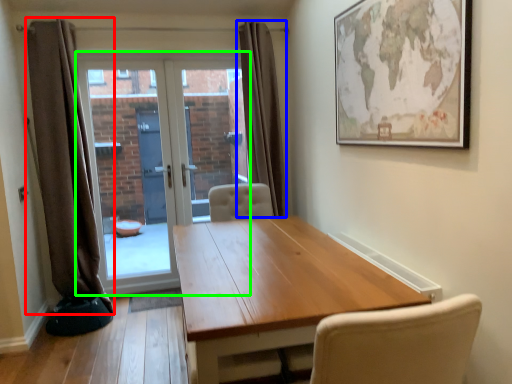
Question: Which object is the closest to the curtain (highlighted by a red box)? Choose among these: curtain (highlighted by a blue box) or door (highlighted by a green box).

Choices:
 (A) curtain
 (B) door

Answer: (B)